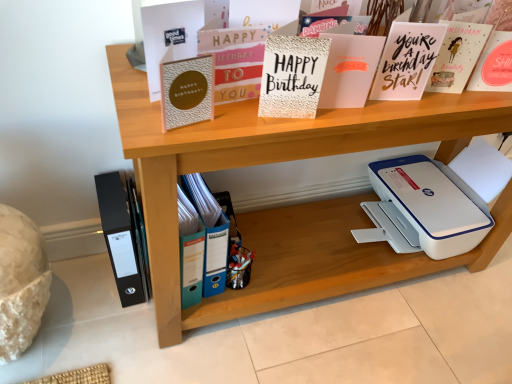
Image resolution: width=512 pixels, height=384 pixels. What are the coordinates of `free space in front of matte gold card at upper center, arranged as the fifth paperback book when viewed from the right` in the screenshot? It's located at (219, 128).